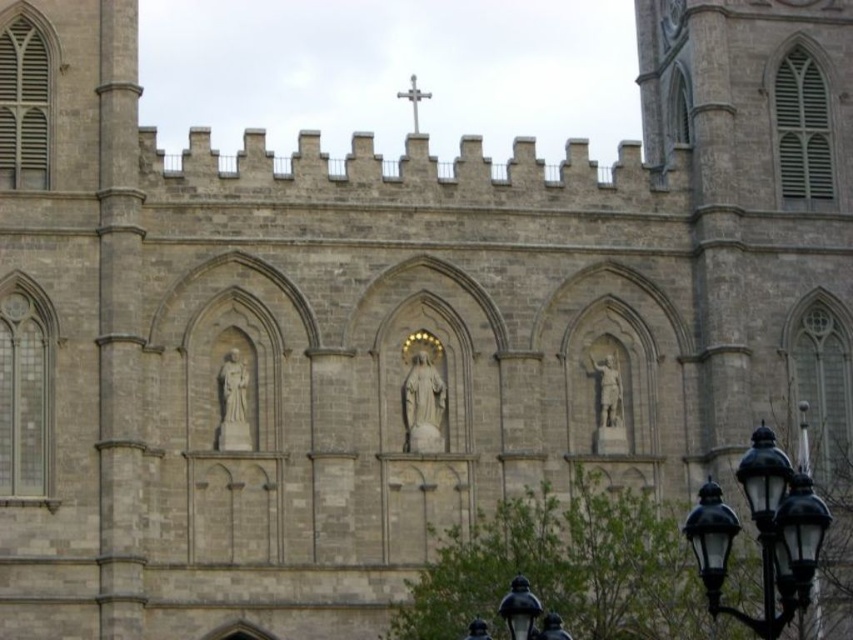
You are standing at the entrance of the stone building and want to locate the black glass streetlight at lower right. According to the coordinates provided, where should you look relative to the building?

The black glass streetlight at lower right is located at coordinates point (762,532), which means it is positioned near the lower right corner of the building.

You are a visitor standing in front of the cathedral and notice the black glass lamp post at lower right and the silver metallic cross at upper center. Which object appears larger in size?

The black glass lamp post at lower right is bigger than the silver metallic cross at upper center, so it appears larger in size.